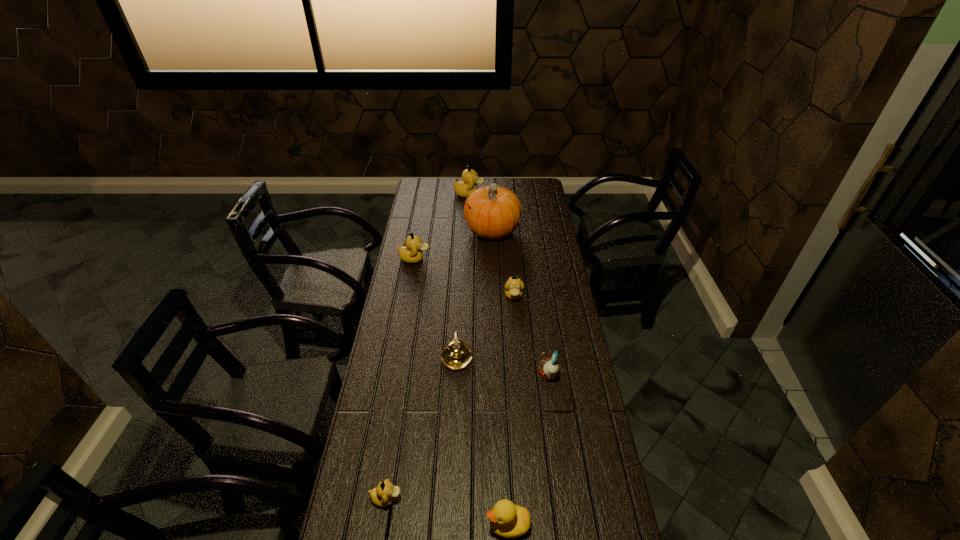
Locate which tan duckling is the third closest to the rightmost object. Please provide its 2D coordinates. Your answer should be formatted as a tuple, i.e. [(x, y)], where the tuple contains the x and y coordinates of a point satisfying the conditions above.

[(411, 253)]

This screenshot has height=540, width=960. In order to click on tan duckling that is the second closest to the orange pumpkin in this screenshot , I will do `click(464, 188)`.

The image size is (960, 540). Find the location of `vacant space that satisfies the following two spatial constraints: 1. on the handle side of the candle holder; 2. on the face of the fourth nearest duckling`. vacant space that satisfies the following two spatial constraints: 1. on the handle side of the candle holder; 2. on the face of the fourth nearest duckling is located at coordinates (462, 259).